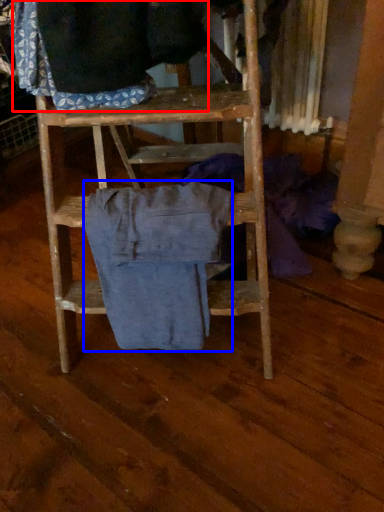
Question: Which point is closer to the camera, clothing (highlighted by a red box) or clothing (highlighted by a blue box)?

Choices:
 (A) clothing
 (B) clothing

Answer: (A)